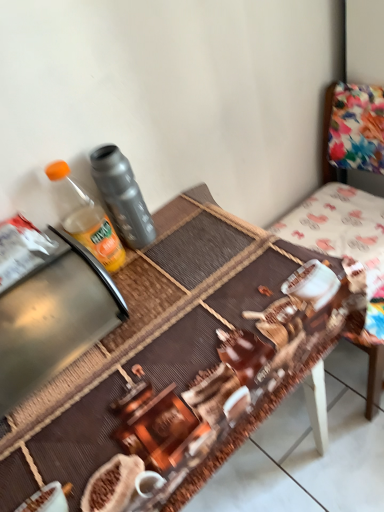
Locate an element on the screen. This screenshot has width=384, height=512. brown woven mat at center is located at coordinates (146, 340).

This screenshot has width=384, height=512. Find the location of `metallic stainless steel appliance at left`. metallic stainless steel appliance at left is located at coordinates tap(52, 323).

The width and height of the screenshot is (384, 512). Describe the element at coordinates (52, 323) in the screenshot. I see `metallic stainless steel appliance at left` at that location.

Identify the location of brown woven mat at center. The width and height of the screenshot is (384, 512). click(146, 340).

From the picture: Considering the sizes of floral fabric chair at upper right and brown woven mat at center in the image, is floral fabric chair at upper right taller or shorter than brown woven mat at center?

floral fabric chair at upper right is taller than brown woven mat at center.

Is floral fabric chair at upper right aimed at brown woven mat at center?

Yes, floral fabric chair at upper right is turned towards brown woven mat at center.

Does point (326, 159) appear closer or farther from the camera than point (231, 308)?

Point (326, 159) appears to be farther away from the viewer than point (231, 308).

Find the location of a particular element. The image size is (384, 512). chair behind the brown woven mat at center is located at coordinates (374, 378).

Between matte gray thermos at left, the 1th bottle viewed from the right, and brown woven mat at center, which one appears on the left side from the viewer's perspective?

From the viewer's perspective, matte gray thermos at left, the 1th bottle viewed from the right, appears more on the left side.

Does point (97, 183) come in front of point (288, 265)?

No, (97, 183) is behind (288, 265).

From a real-world perspective, which object rests below the other?

brown woven mat at center, from a real-world perspective.

Identify the location of table lying in front of the matte gray thermos at left, the 1th bottle viewed from the right. (146, 340).

Which of these two, metallic stainless steel appliance at left or brown woven mat at center, is thinner?

With smaller width is metallic stainless steel appliance at left.

Is brown woven mat at center at the back of metallic stainless steel appliance at left?

No, metallic stainless steel appliance at left's orientation is not away from brown woven mat at center.

From the image's perspective, between metallic stainless steel appliance at left and brown woven mat at center, which one is located above?

metallic stainless steel appliance at left appears higher in the image.

Measure the distance from metallic stainless steel appliance at left to brown woven mat at center.

13.50 centimeters.

From a real-world perspective, who is located lower, metallic stainless steel appliance at left or floral fabric chair at upper right?

floral fabric chair at upper right is physically lower.

Could floral fabric chair at upper right be considered to be inside metallic stainless steel appliance at left?

No, metallic stainless steel appliance at left does not contain floral fabric chair at upper right.

Can you confirm if metallic stainless steel appliance at left is shorter than floral fabric chair at upper right?

Yes, metallic stainless steel appliance at left is shorter than floral fabric chair at upper right.

Which is farther, (x=46, y=337) or (x=324, y=145)?

The point (x=324, y=145) is farther.

Does floral fabric chair at upper right have a larger size compared to translucent plastic bottle at upper left, arranged as the second bottle when viewed from the right?

Yes, floral fabric chair at upper right is bigger than translucent plastic bottle at upper left, arranged as the second bottle when viewed from the right.

Between floral fabric chair at upper right and translucent plastic bottle at upper left, acting as the 1th bottle starting from the left, which one is positioned in front?

translucent plastic bottle at upper left, acting as the 1th bottle starting from the left, is closer to the camera.

Consider the image. What's the angular difference between floral fabric chair at upper right and translucent plastic bottle at upper left, arranged as the second bottle when viewed from the right,'s facing directions?

They differ by 90 degrees in their facing directions.

Is floral fabric chair at upper right shorter than translucent plastic bottle at upper left, acting as the 1th bottle starting from the left?

No, floral fabric chair at upper right is not shorter than translucent plastic bottle at upper left, acting as the 1th bottle starting from the left.

Are translucent plastic bottle at upper left, arranged as the second bottle when viewed from the right, and metallic stainless steel appliance at left far apart?

They are positioned close to each other.

Could you tell me if translucent plastic bottle at upper left, acting as the 1th bottle starting from the left, is turned towards metallic stainless steel appliance at left?

No, translucent plastic bottle at upper left, acting as the 1th bottle starting from the left, does not turn towards metallic stainless steel appliance at left.

Looking at this image, can you confirm if translucent plastic bottle at upper left, acting as the 1th bottle starting from the left, is taller than metallic stainless steel appliance at left?

Yes, translucent plastic bottle at upper left, acting as the 1th bottle starting from the left, is taller than metallic stainless steel appliance at left.

From a real-world perspective, which object rests below the other?

metallic stainless steel appliance at left.

From a real-world perspective, is brown woven mat at center physically located above or below matte gray thermos at left, the 1th bottle viewed from the right?

In terms of real-world spatial position, brown woven mat at center is below matte gray thermos at left, the 1th bottle viewed from the right.

Is point (281, 437) closer to viewer compared to point (107, 169)?

No.

Considering the relative positions of brown woven mat at center and matte gray thermos at left, the 1th bottle viewed from the right, in the image provided, is brown woven mat at center to the right of matte gray thermos at left, the 1th bottle viewed from the right, from the viewer's perspective?

Correct, you'll find brown woven mat at center to the right of matte gray thermos at left, the 1th bottle viewed from the right.

Identify the location of chair located on the right of brown woven mat at center. The width and height of the screenshot is (384, 512). (374, 378).

From the brown woven mat at center, count the 1st bottle to the left and point to it. Please provide its 2D coordinates.

[(122, 196)]

Which object lies nearer to the anchor point translucent plastic bottle at upper left, arranged as the second bottle when viewed from the right, brown woven mat at center or matte gray thermos at left, the 2th bottle when ordered from left to right?

matte gray thermos at left, the 2th bottle when ordered from left to right, lies closer to translucent plastic bottle at upper left, arranged as the second bottle when viewed from the right, than the other object.

From the image, which object appears to be nearer to brown woven mat at center, floral fabric chair at upper right or translucent plastic bottle at upper left, arranged as the second bottle when viewed from the right?

translucent plastic bottle at upper left, arranged as the second bottle when viewed from the right.

Consider the image. From the image, which object appears to be nearer to floral fabric chair at upper right, translucent plastic bottle at upper left, acting as the 1th bottle starting from the left, or matte gray thermos at left, the 1th bottle viewed from the right?

Based on the image, matte gray thermos at left, the 1th bottle viewed from the right, appears to be nearer to floral fabric chair at upper right.

Looking at the image, which one is located closer to brown woven mat at center, translucent plastic bottle at upper left, acting as the 1th bottle starting from the left, or matte gray thermos at left, the 2th bottle when ordered from left to right?

translucent plastic bottle at upper left, acting as the 1th bottle starting from the left, is positioned closer to the anchor brown woven mat at center.

Estimate the real-world distances between objects in this image. Which object is further from matte gray thermos at left, the 1th bottle viewed from the right, floral fabric chair at upper right or metallic stainless steel appliance at left?

floral fabric chair at upper right is further to matte gray thermos at left, the 1th bottle viewed from the right.

Which object lies further to the anchor point metallic stainless steel appliance at left, translucent plastic bottle at upper left, acting as the 1th bottle starting from the left, or brown woven mat at center?

translucent plastic bottle at upper left, acting as the 1th bottle starting from the left, is further to metallic stainless steel appliance at left.

Looking at this image, considering their positions, is matte gray thermos at left, the 1th bottle viewed from the right, positioned further to brown woven mat at center than translucent plastic bottle at upper left, arranged as the second bottle when viewed from the right?

The object further to brown woven mat at center is matte gray thermos at left, the 1th bottle viewed from the right.

Estimate the real-world distances between objects in this image. Which object is further from brown woven mat at center, translucent plastic bottle at upper left, acting as the 1th bottle starting from the left, or floral fabric chair at upper right?

floral fabric chair at upper right is positioned further to the anchor brown woven mat at center.

Identify the location of table situated between translucent plastic bottle at upper left, arranged as the second bottle when viewed from the right, and floral fabric chair at upper right from left to right. (146, 340).

Where is `bottle between matte gray thermos at left, the 2th bottle when ordered from left to right, and brown woven mat at center vertically`? Image resolution: width=384 pixels, height=512 pixels. bottle between matte gray thermos at left, the 2th bottle when ordered from left to right, and brown woven mat at center vertically is located at coordinates (84, 217).

I want to click on appliance between matte gray thermos at left, the 1th bottle viewed from the right, and brown woven mat at center, in the vertical direction, so click(52, 323).

I want to click on bottle between matte gray thermos at left, the 2th bottle when ordered from left to right, and metallic stainless steel appliance at left, in the vertical direction, so click(x=84, y=217).